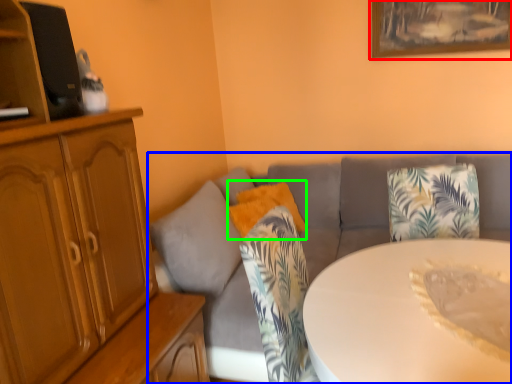
Question: Which is nearer to the picture frame (highlighted by a red box)? studio couch (highlighted by a blue box) or pillow (highlighted by a green box).

Choices:
 (A) studio couch
 (B) pillow

Answer: (A)